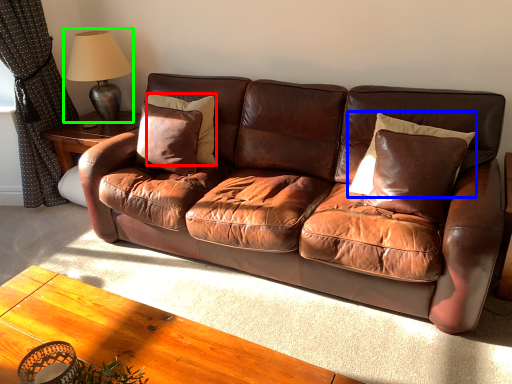
Question: Based on their relative distances, which object is farther from pillow (highlighted by a red box)? Choose from pillow (highlighted by a blue box) and table lamp (highlighted by a green box).

Choices:
 (A) pillow
 (B) table lamp

Answer: (A)